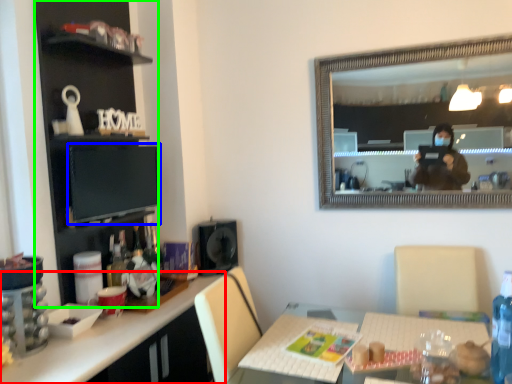
Question: Considering the real-world distances, which object is farthest from desk (highlighted by a red box)? computer monitor (highlighted by a blue box) or cabinetry (highlighted by a green box)?

Choices:
 (A) computer monitor
 (B) cabinetry

Answer: (B)